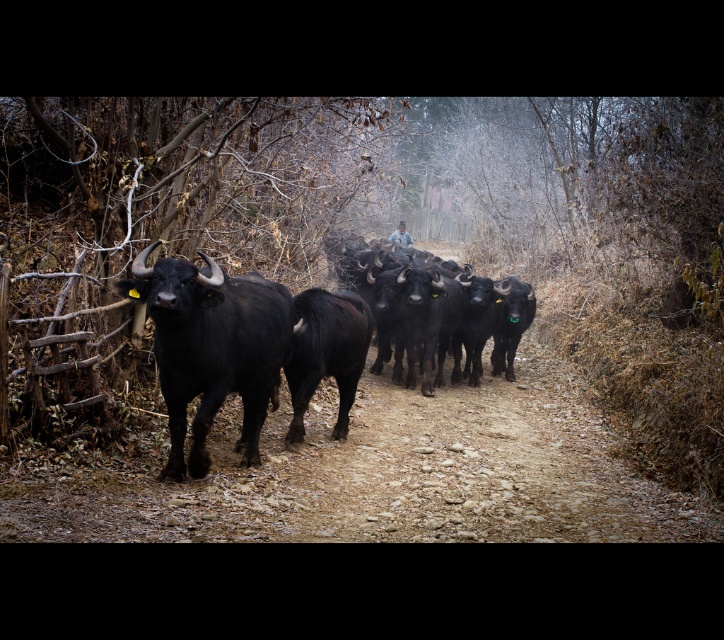
You are standing on the path in the rural scene and notice two points marked on the ground. The first point is at coordinates point (252,369) and the second is at point (287,371). Which point is closer to you?

Point (252,369) is closer to the viewer than point (287,371).

You are a farmer observing the buffaloes in the image. You notice two bulls at the center of the group. Which bull is positioned lower in the image? The shiny black bull at center or the black shaggy bull at center?

The shiny black bull at center is positioned lower than the black shaggy bull at center in the image.